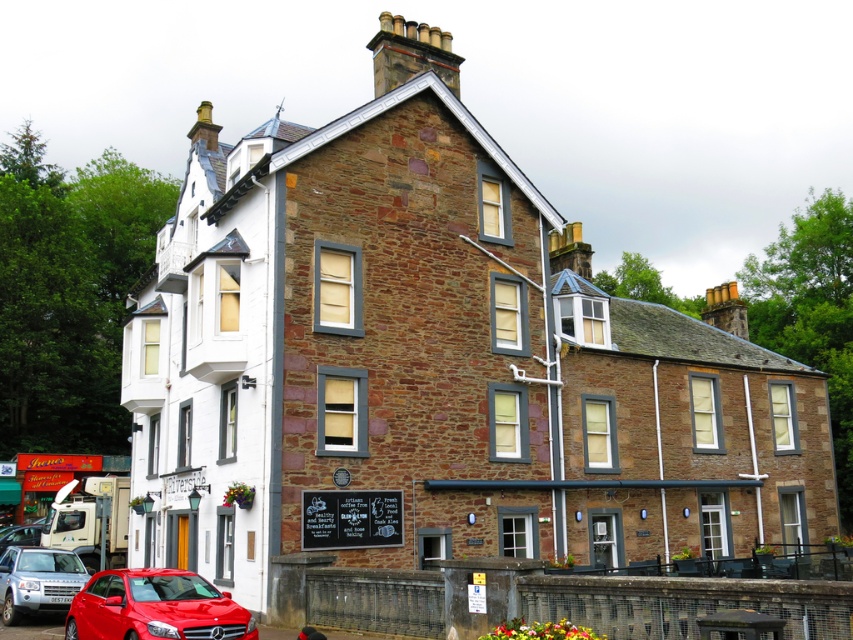
You are a pedestrian standing in front of the multi story building. You see two cars at the lower left of the image. Which car is closer to you, the shiny red car at lower left or the metallic red car at lower left?

The shiny red car at lower left is closer to you because it is in front of the metallic red car at lower left.

You are a delivery driver who needs to park your shiny red car at lower left and metallic red car at lower left in the parking lot next to the building. Given that the parking spots are only 5 meters apart, can both cars fit side by side without overlapping?

The shiny red car at lower left is larger in size than metallic red car at lower left. However, since the parking spots are 5 meters apart, both cars can fit side by side as long as they are parked properly within their designated spaces.